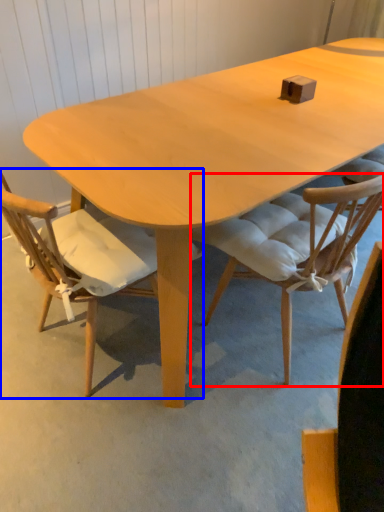
Question: Which object is closer to the camera taking this photo, chair (highlighted by a red box) or chair (highlighted by a blue box)?

Choices:
 (A) chair
 (B) chair

Answer: (B)